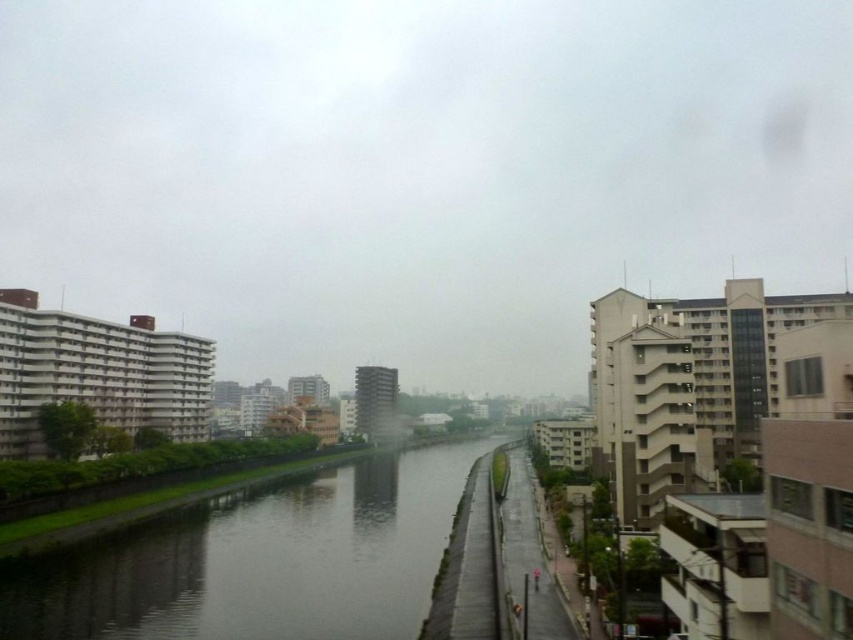
What do you see at coordinates (418, 170) in the screenshot? I see `transparent glass sky at upper center` at bounding box center [418, 170].

Does transparent glass sky at upper center have a greater height compared to smooth concrete river at center?

Correct, transparent glass sky at upper center is much taller as smooth concrete river at center.

Between point (560, 336) and point (373, 580), which one is positioned in front?

Point (373, 580) is in front.

You are a GUI agent. You are given a task and a screenshot of the screen. Output one action in this format:
    pyautogui.click(x=<x>, y=<y>)
    Task: Click on the transparent glass sky at upper center
    This screenshot has width=853, height=640.
    Given the screenshot: What is the action you would take?
    pyautogui.click(x=418, y=170)